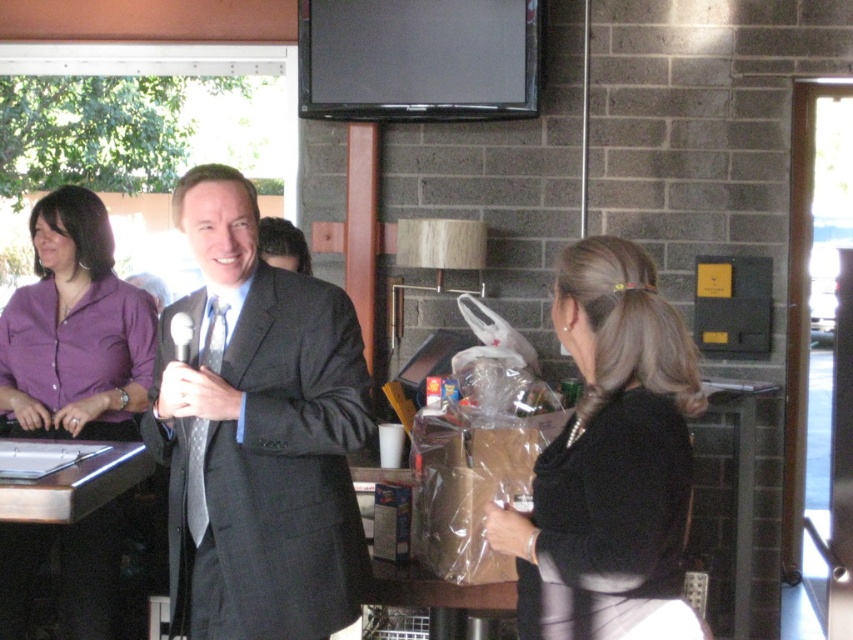
You are standing at the event and want to take a photo that includes both point (703, 396) and point (33, 252). Which point will appear larger in the photo?

Point (703, 396) is closer to the camera than point (33, 252), so it will appear larger in the photo.